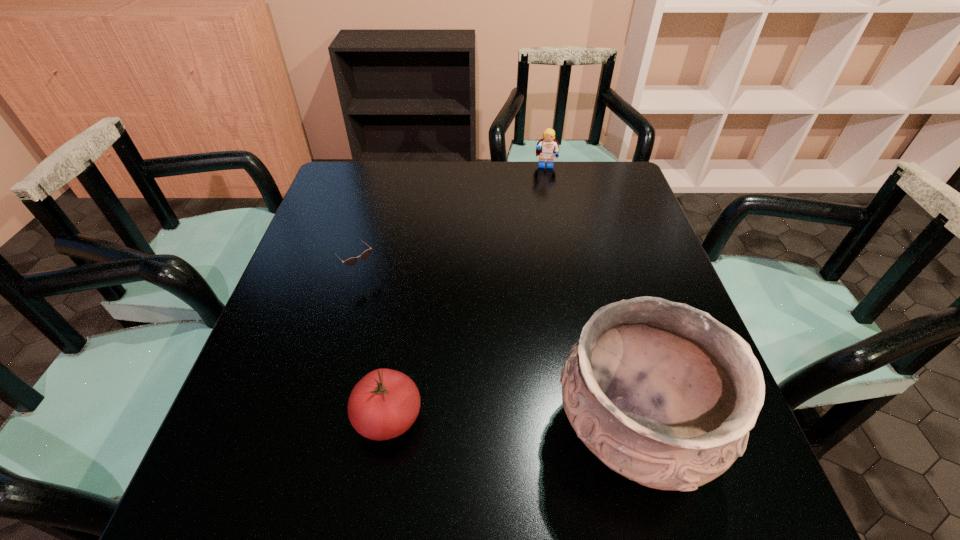
Identify the location of free region located 0.360m on the front-facing side of the Lego. (544, 245).

Locate an element on the screen. Image resolution: width=960 pixels, height=540 pixels. vacant area situated on the front-facing side of the Lego is located at coordinates (544, 255).

You are a GUI agent. You are given a task and a screenshot of the screen. Output one action in this format:
    pyautogui.click(x=<x>, y=<y>)
    Task: Click on the free space located 0.080m on the front-facing side of the Lego
    The image size is (960, 540).
    Given the screenshot: What is the action you would take?
    pyautogui.click(x=545, y=186)

You are a GUI agent. You are given a task and a screenshot of the screen. Output one action in this format:
    pyautogui.click(x=<x>, y=<y>)
    Task: Click on the object positioned at the far edge
    Image resolution: width=960 pixels, height=540 pixels.
    Given the screenshot: What is the action you would take?
    point(548,148)

You are a GUI agent. You are given a task and a screenshot of the screen. Output one action in this format:
    pyautogui.click(x=<x>, y=<y>)
    Task: Click on the tomato present at the near edge
    The width and height of the screenshot is (960, 540).
    Given the screenshot: What is the action you would take?
    pyautogui.click(x=384, y=404)

Find the location of a particular element. This screenshot has height=540, width=960. pottery situated at the near edge is located at coordinates (662, 393).

Find the location of a particular element. The height and width of the screenshot is (540, 960). object at the left edge is located at coordinates (350, 262).

Where is `object that is positioned at the right edge`? object that is positioned at the right edge is located at coordinates (662, 393).

Image resolution: width=960 pixels, height=540 pixels. What are the coordinates of `object that is positioned at the near right corner` in the screenshot? It's located at (662, 393).

The width and height of the screenshot is (960, 540). I want to click on free region at the far edge, so click(x=399, y=184).